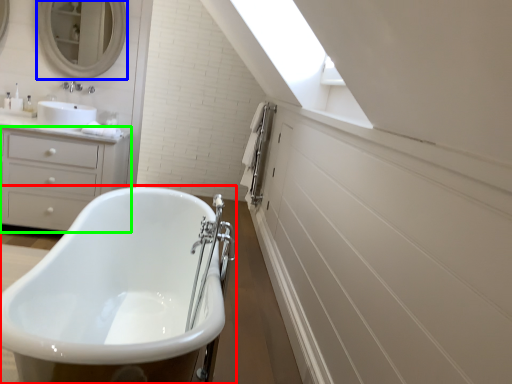
Question: Which is farther away from bathtub (highlighted by a red box)? mirror (highlighted by a blue box) or chest of drawers (highlighted by a green box)?

Choices:
 (A) mirror
 (B) chest of drawers

Answer: (A)